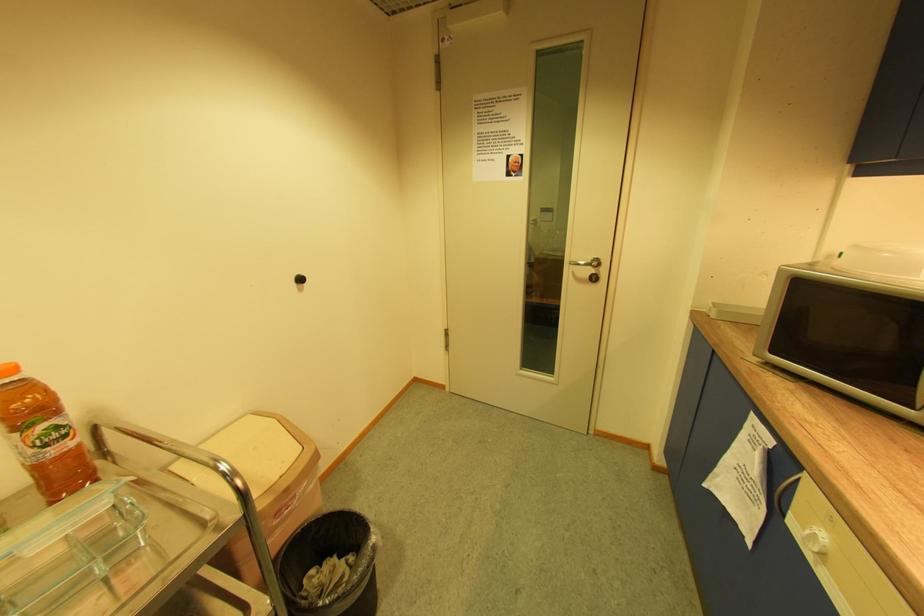
This screenshot has width=924, height=616. I want to click on black trash can, so click(x=331, y=564).